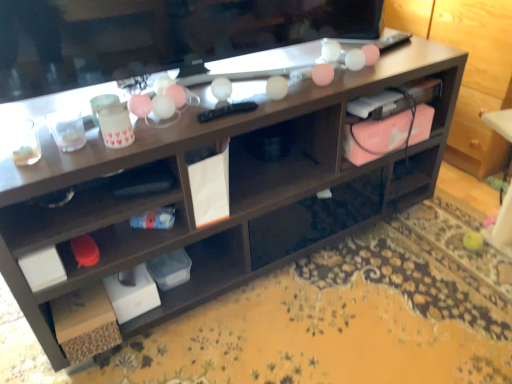
The width and height of the screenshot is (512, 384). What do you see at coordinates (156, 36) in the screenshot? I see `matte black television at upper center` at bounding box center [156, 36].

Identify the location of matte black television at upper center. (x=156, y=36).

What is the approximate height of matte black television at upper center?

The height of matte black television at upper center is 11.51 inches.

Measure the distance between matte black television at upper center and camera.

They are 36.63 inches apart.

The width and height of the screenshot is (512, 384). What do you see at coordinates (389, 120) in the screenshot? I see `pink matte laptop at right` at bounding box center [389, 120].

Measure the distance between pink matte laptop at right and camera.

pink matte laptop at right and camera are 1.27 meters apart from each other.

Where is `pink matte laptop at right`? pink matte laptop at right is located at coordinates (389, 120).

Find the location of `matte black television at upper center`. matte black television at upper center is located at coordinates (156, 36).

Considering the positions of objects matte black television at upper center and pink matte laptop at right in the image provided, who is more to the right, matte black television at upper center or pink matte laptop at right?

pink matte laptop at right is more to the right.

Between matte black television at upper center and pink matte laptop at right, which one is positioned in front?

Positioned in front is matte black television at upper center.

Which is in front, point (284, 38) or point (364, 120)?

Point (284, 38)

From the image's perspective, which one is positioned higher, matte black television at upper center or pink matte laptop at right?

matte black television at upper center, from the image's perspective.

From a real-world perspective, is matte black television at upper center located higher than pink matte laptop at right?

Yes, from a real-world perspective, matte black television at upper center is above pink matte laptop at right.

Which object is wider, matte black television at upper center or pink matte laptop at right?

Wider between the two is matte black television at upper center.

Considering the relative sizes of matte black television at upper center and pink matte laptop at right in the image provided, is matte black television at upper center taller than pink matte laptop at right?

Yes, matte black television at upper center is taller than pink matte laptop at right.

Is matte black television at upper center bigger than pink matte laptop at right?

Yes.

Is matte black television at upper center completely or partially outside of pink matte laptop at right?

That's correct, matte black television at upper center is outside of pink matte laptop at right.

Is the surface of matte black television at upper center in direct contact with pink matte laptop at right?

No, matte black television at upper center is not beside pink matte laptop at right.

Is matte black television at upper center turned away from pink matte laptop at right?

No, pink matte laptop at right is not at the back of matte black television at upper center.

Can you tell me how much matte black television at upper center and pink matte laptop at right differ in facing direction?

matte black television at upper center and pink matte laptop at right are facing 4.01 degrees away from each other.

At what (x,y) coordinates should I click in order to perform the action: click on cabinet that appears below the matte black television at upper center (from a real-world perspective). Please return your answer as a coordinate pair (x, y). Looking at the image, I should click on (389, 120).

Would you say pink matte laptop at right is to the left or to the right of matte black television at upper center in the picture?

From the image, it's evident that pink matte laptop at right is to the right of matte black television at upper center.

Is pink matte laptop at right in front of or behind matte black television at upper center in the image?

pink matte laptop at right is positioned farther from the viewer than matte black television at upper center.

Which is further, (x=431, y=118) or (x=380, y=11)?

Positioned behind is point (x=380, y=11).

From the image's perspective, would you say pink matte laptop at right is shown under matte black television at upper center?

Yes, from the image's perspective, pink matte laptop at right is below matte black television at upper center.

From a real-world perspective, who is located lower, pink matte laptop at right or matte black television at upper center?

pink matte laptop at right is physically lower.

Considering the sizes of pink matte laptop at right and matte black television at upper center in the image, is pink matte laptop at right wider or thinner than matte black television at upper center?

pink matte laptop at right is thinner than matte black television at upper center.

Considering the sizes of objects pink matte laptop at right and matte black television at upper center in the image provided, who is shorter, pink matte laptop at right or matte black television at upper center?

With less height is pink matte laptop at right.

Which of these two, pink matte laptop at right or matte black television at upper center, is bigger?

Bigger between the two is matte black television at upper center.

Is pink matte laptop at right outside of matte black television at upper center?

Yes.

Are pink matte laptop at right and matte black television at upper center located far from each other?

They are positioned close to each other.

Is pink matte laptop at right turned away from matte black television at upper center?

pink matte laptop at right does not have its back to matte black television at upper center.

How distant is pink matte laptop at right from matte black television at upper center?

pink matte laptop at right and matte black television at upper center are 17.52 inches apart.

What are the coordinates of `cabinet behind the matte black television at upper center` in the screenshot? It's located at (389, 120).

Find the location of a particular element. This screenshot has width=512, height=384. cabinet behind the matte black television at upper center is located at coordinates (389, 120).

The height and width of the screenshot is (384, 512). Identify the location of cabinet located below the matte black television at upper center (from the image's perspective). (389, 120).